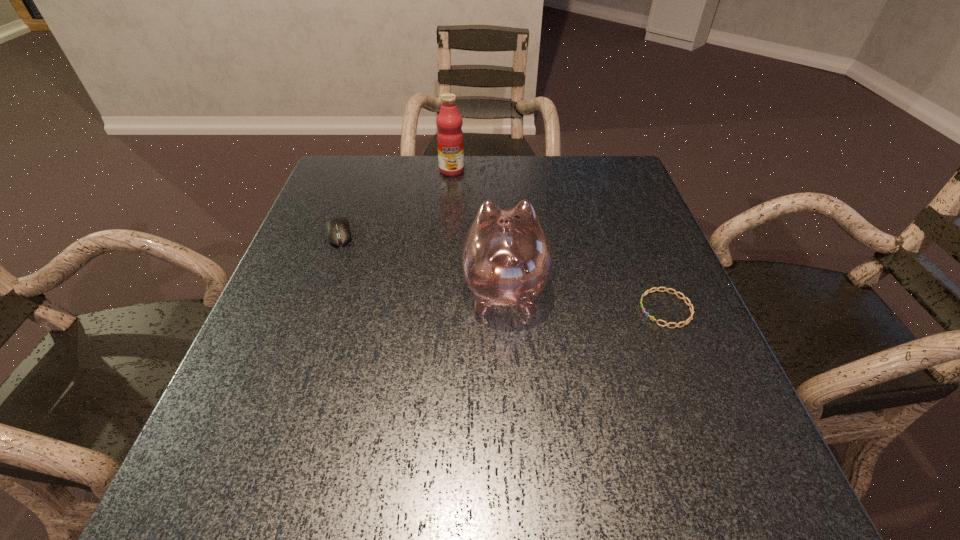
This screenshot has height=540, width=960. In order to click on free spot at the left edge of the desktop in this screenshot , I will do `click(219, 439)`.

This screenshot has height=540, width=960. Identify the location of vacant point at the right edge. (625, 241).

Find the location of `vacant space at the far left corner of the desktop`. vacant space at the far left corner of the desktop is located at coordinates coord(372,185).

This screenshot has height=540, width=960. I want to click on blank space at the far right corner of the desktop, so click(580, 198).

Locate an element on the screen. free spot between the bracelet and the third shortest object is located at coordinates (585, 299).

The image size is (960, 540). I want to click on empty location between the shortest object and the third shortest object, so click(x=585, y=299).

Find the location of `free space between the shortest object and the third object from left to right`. free space between the shortest object and the third object from left to right is located at coordinates (585, 299).

Locate an element on the screen. Image resolution: width=960 pixels, height=540 pixels. vacant space that's between the farthest object and the third tallest object is located at coordinates (396, 202).

I want to click on vacant space in between the rightmost object and the piggy bank, so click(x=585, y=299).

Identify which object is located as the third nearest to the second object from right to left. Please provide its 2D coordinates. Your answer should be formatted as a tuple, i.e. [(x, y)], where the tuple contains the x and y coordinates of a point satisfying the conditions above.

[(450, 141)]